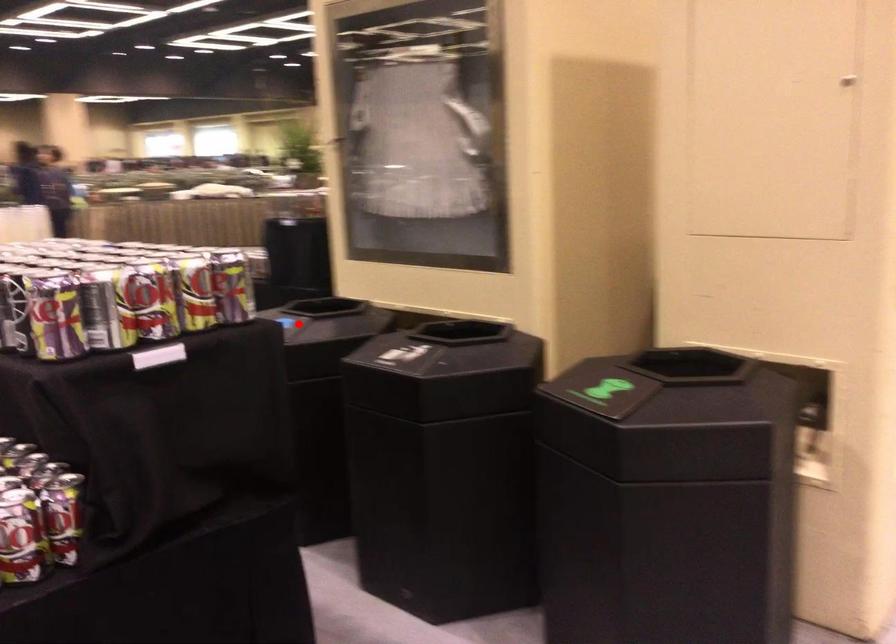
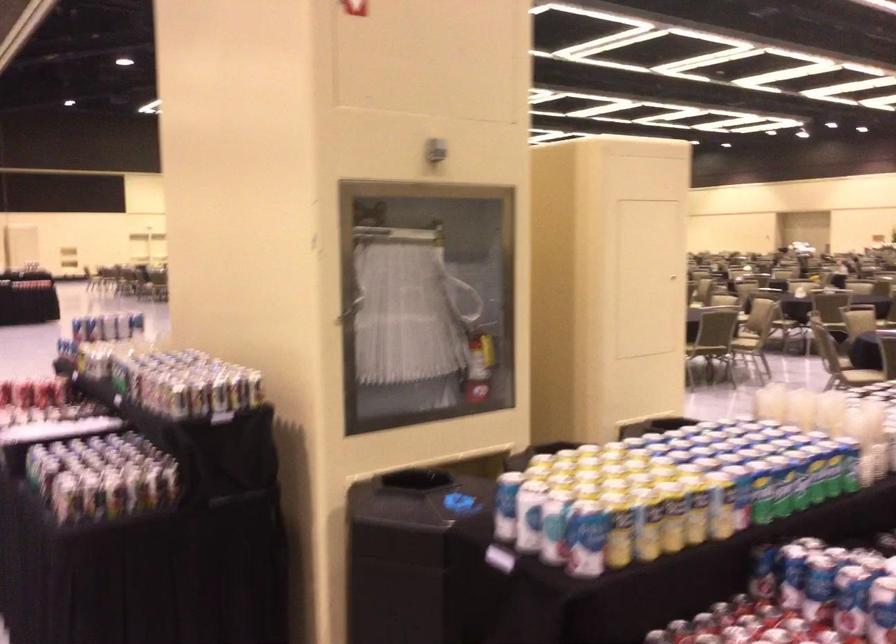
The point at the highlighted location is marked in the first image. Where is the corresponding point in the second image?

(442, 502)